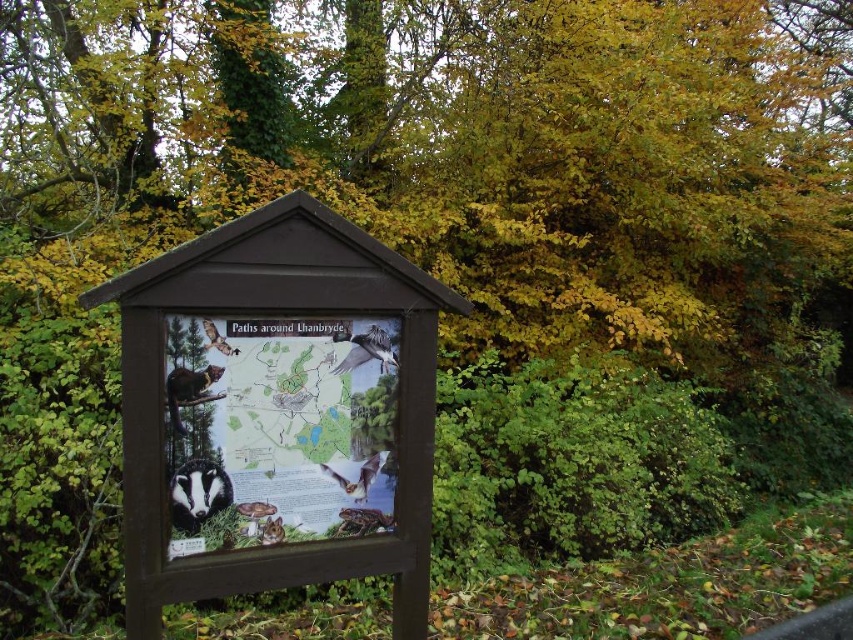
From the picture: Does matte paper map at center appear on the right side of brown furry bat at lower center?

In fact, matte paper map at center is to the left of brown furry bat at lower center.

Describe the element at coordinates (277, 428) in the screenshot. I see `matte paper map at center` at that location.

Where is `matte paper map at center`? matte paper map at center is located at coordinates (277, 428).

The height and width of the screenshot is (640, 853). In order to click on matte paper map at center in this screenshot , I will do `click(277, 428)`.

Between point (207, 464) and point (225, 349), which one is positioned behind?

The point (207, 464) is behind.

Find the location of a particular element. The width and height of the screenshot is (853, 640). matte paper map at center is located at coordinates (277, 428).

Locate an element on the screen. matte paper map at center is located at coordinates (277, 428).

Who is shorter, wooden signboard at center or brown furry bat at lower center?

Standing shorter between the two is brown furry bat at lower center.

Who is higher up, wooden signboard at center or brown furry bat at lower center?

wooden signboard at center is higher up.

What do you see at coordinates (276, 404) in the screenshot? I see `wooden signboard at center` at bounding box center [276, 404].

Find the location of a particular element. This screenshot has height=640, width=853. wooden signboard at center is located at coordinates (276, 404).